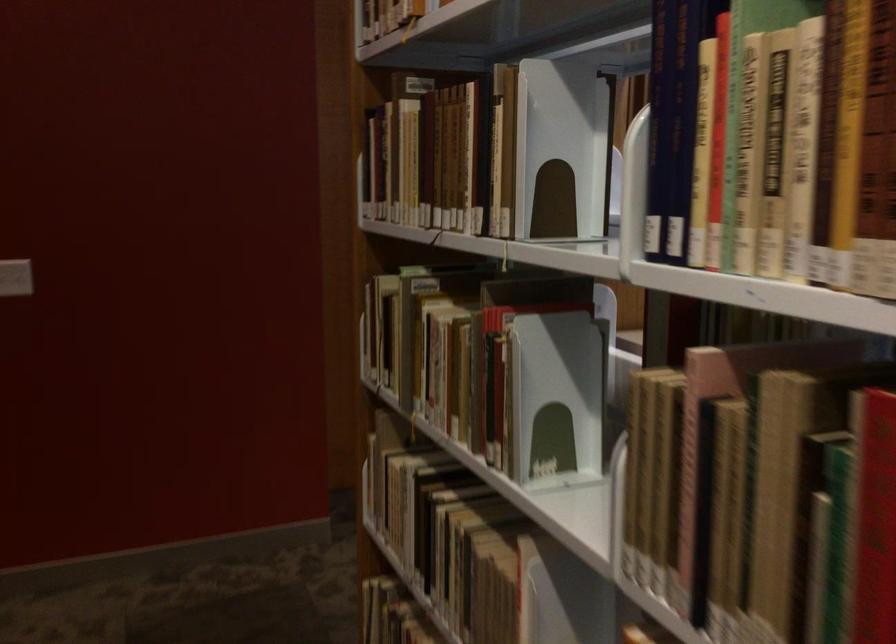
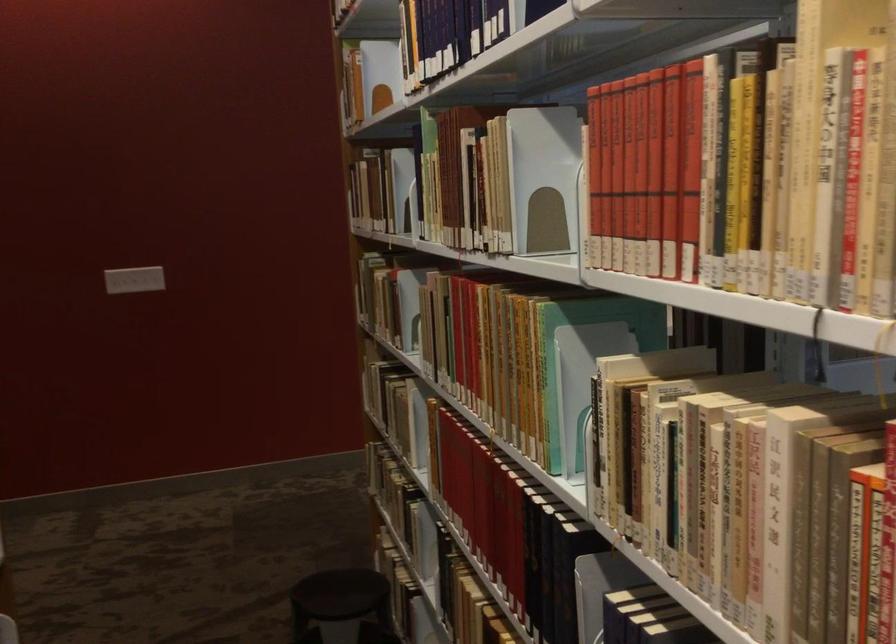
Question: I am providing you with two images of the same scene from different viewpoints. Please identify which objects are invisible in image2.

Choices:
 (A) red book
 (B) white plastic lid
 (C) yellow book
 (D) hardcover book

Answer: (D)